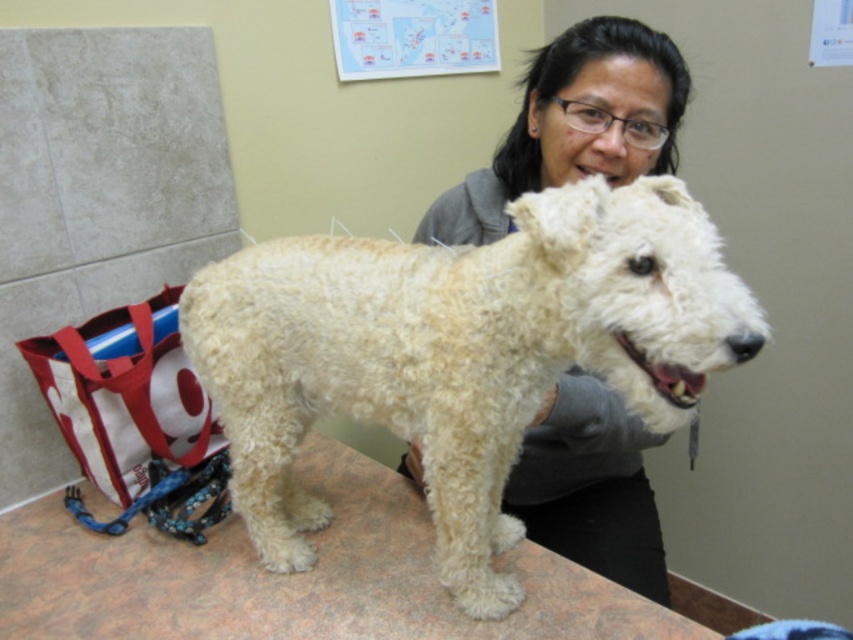
You are a veterinary assistant who needs to place a 1.2 meter wide medical tray on the smooth brown table at center. Can the medical tray fit on the table if the smooth gray hoodie at center is currently occupying some space?

The smooth brown table at center might be wider than smooth gray hoodie at center. Therefore, there might be enough space left on the table after accounting for the hoodie to accommodate the 1.2 meter wide medical tray, but it depends on the exact dimensions.

Based on the photo, you are a small robot with a width of 12 inches. You need to move between the smooth brown table at center and the smooth gray hoodie at center. Based on the scene, can you fit through the space between them?

The smooth brown table at center and smooth gray hoodie at center are 11.38 inches apart from each other. Since the robot is 12 inches wide, it cannot fit through the space between them.

You need to place a small toy exactly at the center of the veterinary examination table where the white fluffy dog at center is standing. According to the coordinates provided, will the toy be placed directly under the dog or to the side?

The white fluffy dog at center is located at point (460, 353), which is near the center of the table. The toy placed at the exact center would be slightly to the side relative to the dog.